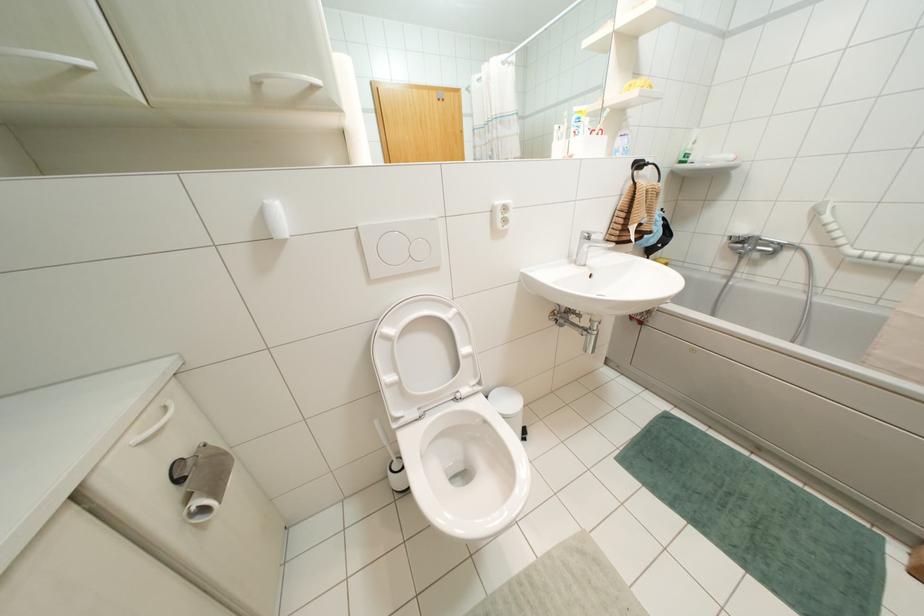
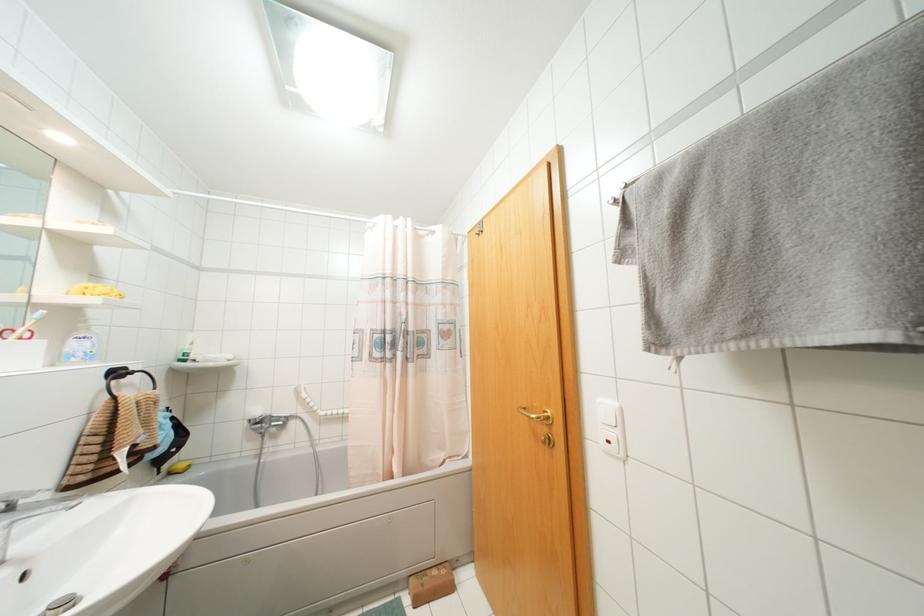
Where in the second image is the point corresponding to point 743,230 from the first image?

(258, 411)